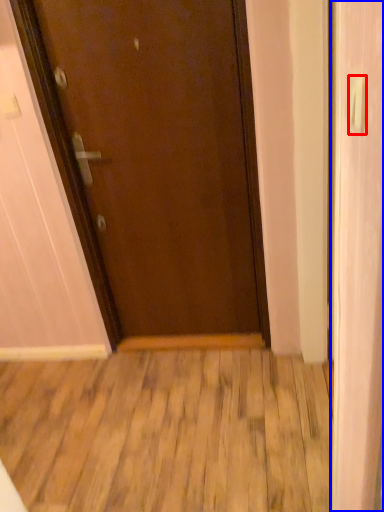
Question: Among these objects, which one is farthest to the camera, door handle (highlighted by a red box) or screen door (highlighted by a blue box)?

Choices:
 (A) door handle
 (B) screen door

Answer: (B)